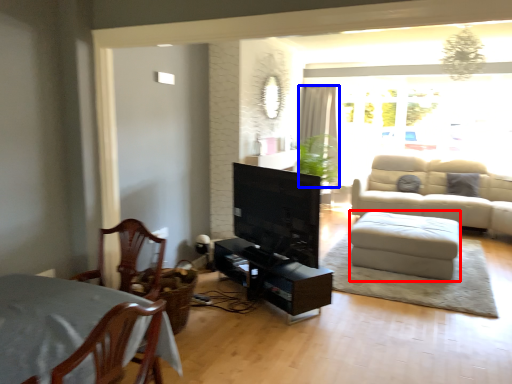
Question: Which object appears farthest to the camera in this image, footrest (highlighted by a red box) or curtain (highlighted by a blue box)?

Choices:
 (A) footrest
 (B) curtain

Answer: (B)